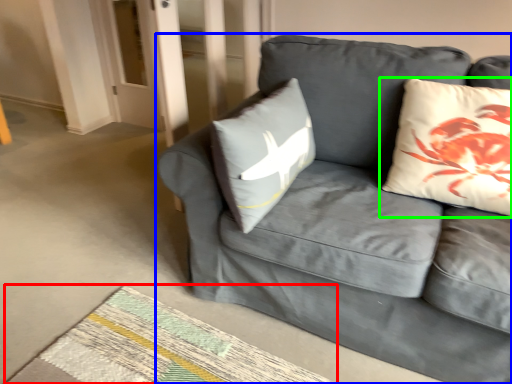
Question: Considering the real-world distances, which object is farthest from mat (highlighted by a red box)? studio couch (highlighted by a blue box) or pillow (highlighted by a green box)?

Choices:
 (A) studio couch
 (B) pillow

Answer: (B)